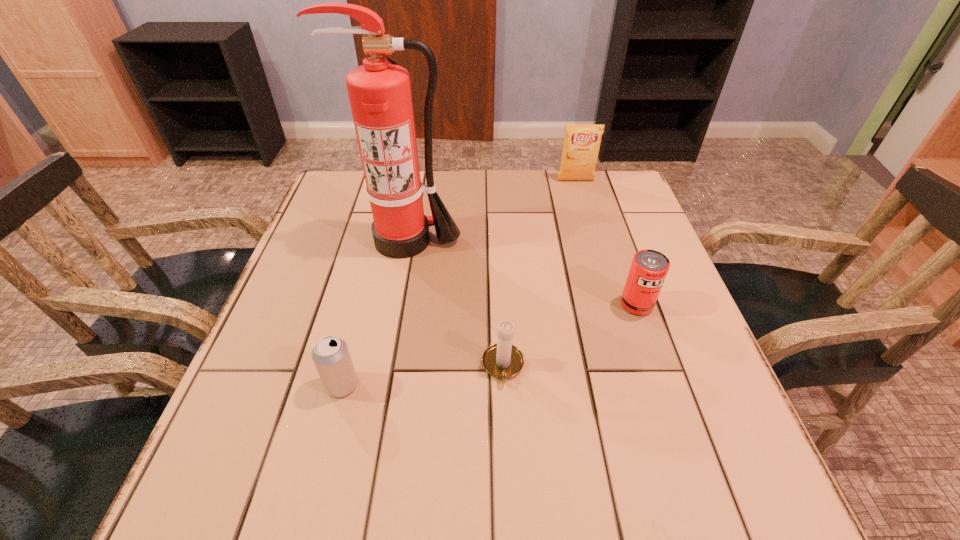
At what (x,y) coordinates should I click in order to perform the action: click on the tallest object. Please return your answer as a coordinate pair (x, y). The height and width of the screenshot is (540, 960). Looking at the image, I should click on (379, 92).

Locate an element on the screen. This screenshot has height=540, width=960. fire extinguisher is located at coordinates (379, 92).

Identify the location of the second tallest object. The image size is (960, 540). (581, 146).

What are the coordinates of `the farthest object` in the screenshot? It's located at (581, 146).

I want to click on can, so click(649, 268).

In order to click on the third object from right to left in this screenshot , I will do `click(502, 360)`.

This screenshot has width=960, height=540. I want to click on beer can, so click(x=331, y=356).

Image resolution: width=960 pixels, height=540 pixels. Find the location of `free space located at the nozzle of the second farthest object`. free space located at the nozzle of the second farthest object is located at coordinates (399, 279).

Where is `vacant area located 0.220m on the front of the farthest object with the logo`? This screenshot has height=540, width=960. vacant area located 0.220m on the front of the farthest object with the logo is located at coordinates (590, 230).

Where is `vacant region located on the left of the can`? vacant region located on the left of the can is located at coordinates (597, 305).